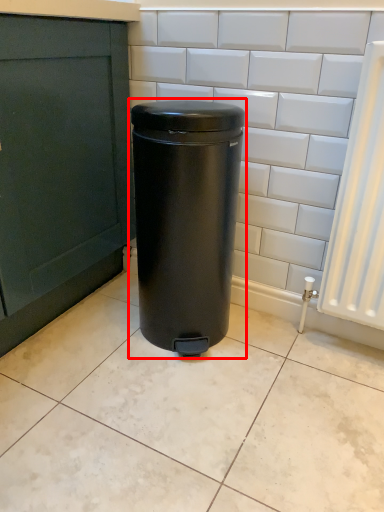
Question: Considering the relative positions of waste container (annotated by the red box) and ceramic tile in the image provided, where is waste container (annotated by the red box) located with respect to the staircase?

Choices:
 (A) left
 (B) right

Answer: (B)